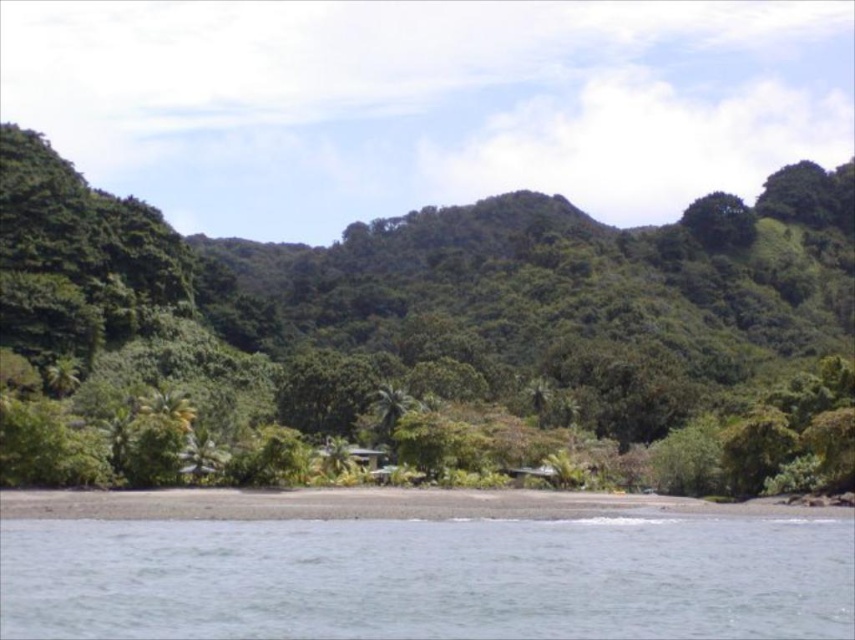
Question: Does clear water at lower left have a lesser width compared to green leafy tree at upper right?

Choices:
 (A) no
 (B) yes

Answer: (A)

Question: Which object appears farthest from the camera in this image?

Choices:
 (A) green leafy tree at upper right
 (B) green leafy tree at center

Answer: (A)

Question: Which point appears closest to the camera in this image?

Choices:
 (A) (260, 568)
 (B) (587, 392)
 (C) (723, 250)

Answer: (A)

Question: Can you confirm if clear water at lower left is smaller than green leafy tree at upper right?

Choices:
 (A) no
 (B) yes

Answer: (B)

Question: Is clear water at lower left above green leafy tree at upper right?

Choices:
 (A) no
 (B) yes

Answer: (A)

Question: Which of the following is the farthest from the observer?

Choices:
 (A) clear water at lower left
 (B) green leafy tree at upper right

Answer: (B)